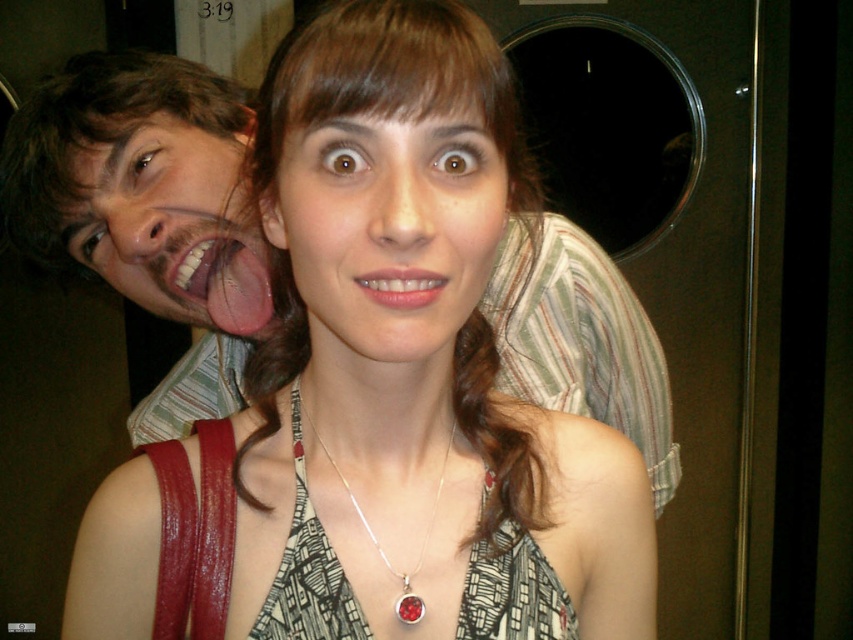
Question: Does smooth skin face at center lie in front of pink matte lips at center?

Choices:
 (A) no
 (B) yes

Answer: (B)

Question: Based on their relative distances, which object is nearer to the silver/red gemstone pendant at center?

Choices:
 (A) pink matte lips at center
 (B) pink glossy tongue at center

Answer: (A)

Question: Estimate the real-world distances between objects in this image. Which object is closer to the matte fabric dress at center?

Choices:
 (A) pink glossy tongue at center
 (B) smooth skin face at center

Answer: (B)

Question: Does matte fabric dress at center have a larger size compared to silver/red gemstone pendant at center?

Choices:
 (A) yes
 (B) no

Answer: (A)

Question: Which point is closer to the camera?

Choices:
 (A) (299, 538)
 (B) (341, 570)
 (C) (289, 180)
 (D) (90, 216)

Answer: (C)

Question: Is matte fabric dress at center smaller than matte skin face at upper left?

Choices:
 (A) no
 (B) yes

Answer: (A)